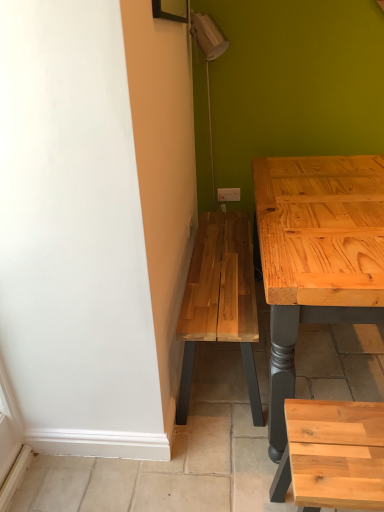
Question: Is white plastic electric outlet at upper center situated inside natural wood stool at lower right or outside?

Choices:
 (A) outside
 (B) inside

Answer: (A)

Question: Does point (228, 195) appear closer or farther from the camera than point (297, 455)?

Choices:
 (A) farther
 (B) closer

Answer: (A)

Question: From a real-world perspective, is white plastic electric outlet at upper center positioned above or below natural wood stool at lower right?

Choices:
 (A) below
 (B) above

Answer: (B)

Question: Based on their positions, is natural wood stool at lower right located to the left or right of white plastic electric outlet at upper center?

Choices:
 (A) right
 (B) left

Answer: (A)

Question: Is natural wood stool at lower right inside or outside of white plastic electric outlet at upper center?

Choices:
 (A) inside
 (B) outside

Answer: (B)

Question: Does point (359, 458) appear closer or farther from the camera than point (231, 201)?

Choices:
 (A) farther
 (B) closer

Answer: (B)

Question: In terms of width, does natural wood stool at lower right look wider or thinner when compared to white plastic electric outlet at upper center?

Choices:
 (A) thin
 (B) wide

Answer: (B)